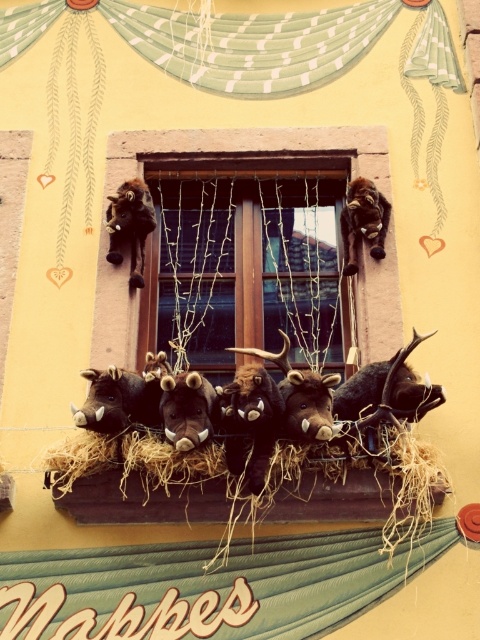
From the picture: Who is shorter, wooden window at center or brown plush goat at upper left?

Standing shorter between the two is brown plush goat at upper left.

Who is taller, wooden window at center or brown plush goat at upper left?

Standing taller between the two is wooden window at center.

Measure the distance between point (195, 248) and camera.

47.47 meters

Find the location of a particular element. wooden window at center is located at coordinates coord(249,262).

Does wooden window at center come behind brown plush toy at upper center?

No, wooden window at center is closer to the viewer.

Between wooden window at center and brown plush toy at upper center, which one is positioned higher?

brown plush toy at upper center is higher up.

Who is more forward, [239,264] or [368,179]?

Positioned in front is point [368,179].

You are a GUI agent. You are given a task and a screenshot of the screen. Output one action in this format:
    pyautogui.click(x=<x>, y=<y>)
    Task: Click on the wooden window at center
    This screenshot has height=640, width=480.
    Given the screenshot: What is the action you would take?
    pyautogui.click(x=249, y=262)

Is brown plush goat at upper left positioned behind brown plush toy at upper center?

That is False.

Does brown plush goat at upper left have a lesser width compared to brown plush toy at upper center?

In fact, brown plush goat at upper left might be wider than brown plush toy at upper center.

Is point (122, 220) closer to camera compared to point (357, 269)?

Yes.

Where is `brown plush goat at upper left`? This screenshot has height=640, width=480. brown plush goat at upper left is located at coordinates (130, 225).